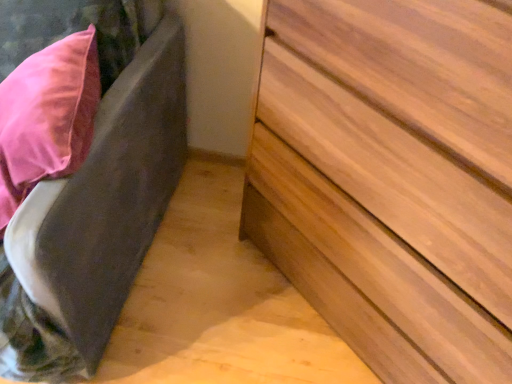
Question: Can you confirm if velvet gray bed frame at left is bigger than light brown wood chest of drawers at lower right?

Choices:
 (A) yes
 (B) no

Answer: (A)

Question: From a real-world perspective, is velvet gray bed frame at left beneath light brown wood chest of drawers at lower right?

Choices:
 (A) no
 (B) yes

Answer: (B)

Question: Is velvet gray bed frame at left smaller than light brown wood chest of drawers at lower right?

Choices:
 (A) yes
 (B) no

Answer: (B)

Question: From a real-world perspective, is velvet gray bed frame at left on light brown wood chest of drawers at lower right?

Choices:
 (A) no
 (B) yes

Answer: (A)

Question: Could light brown wood chest of drawers at lower right be considered to be inside velvet gray bed frame at left?

Choices:
 (A) no
 (B) yes

Answer: (A)

Question: Is velvet gray bed frame at left looking in the opposite direction of light brown wood chest of drawers at lower right?

Choices:
 (A) no
 (B) yes

Answer: (A)

Question: Can you confirm if light brown wood chest of drawers at lower right is positioned to the right of velvet gray bed frame at left?

Choices:
 (A) yes
 (B) no

Answer: (A)

Question: From the image's perspective, is light brown wood chest of drawers at lower right on velvet gray bed frame at left?

Choices:
 (A) no
 (B) yes

Answer: (A)

Question: Is light brown wood chest of drawers at lower right positioned in front of velvet gray bed frame at left?

Choices:
 (A) yes
 (B) no

Answer: (A)

Question: Is light brown wood chest of drawers at lower right not within velvet gray bed frame at left?

Choices:
 (A) no
 (B) yes

Answer: (B)

Question: From the image's perspective, is light brown wood chest of drawers at lower right located beneath velvet gray bed frame at left?

Choices:
 (A) no
 (B) yes

Answer: (B)

Question: Considering the relative sizes of light brown wood chest of drawers at lower right and velvet gray bed frame at left in the image provided, is light brown wood chest of drawers at lower right bigger than velvet gray bed frame at left?

Choices:
 (A) no
 (B) yes

Answer: (A)

Question: Considering the positions of velvet gray bed frame at left and light brown wood chest of drawers at lower right in the image, is velvet gray bed frame at left wider or thinner than light brown wood chest of drawers at lower right?

Choices:
 (A) wide
 (B) thin

Answer: (A)